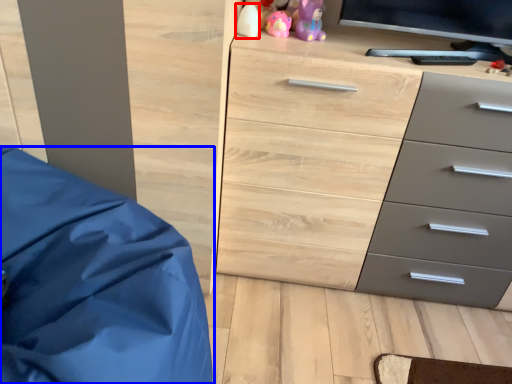
Question: Which of the following is the farthest to the observer, toy (highlighted by a red box) or furniture (highlighted by a blue box)?

Choices:
 (A) toy
 (B) furniture

Answer: (A)